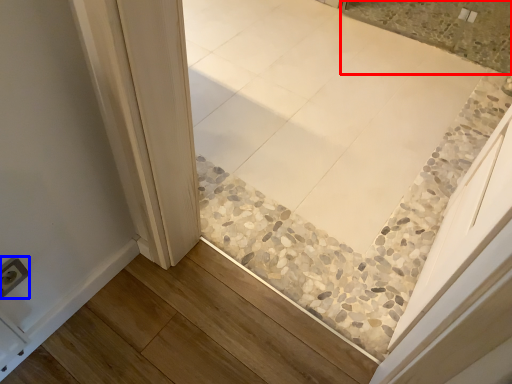
Question: Which object appears farthest to the camera in this image, tile (highlighted by a red box) or electric outlet (highlighted by a blue box)?

Choices:
 (A) tile
 (B) electric outlet

Answer: (A)